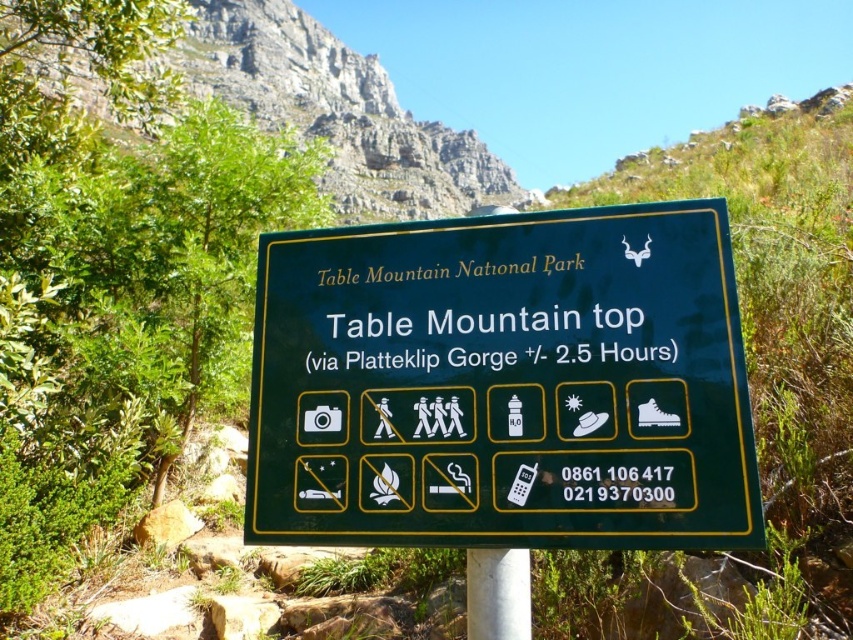
Question: From the image, what is the correct spatial relationship of green matte sign at center in relation to white smooth pole at center?

Choices:
 (A) right
 (B) left

Answer: (B)

Question: Does green matte sign at center lie in front of white smooth pole at center?

Choices:
 (A) no
 (B) yes

Answer: (B)

Question: Can you confirm if green matte sign at center is bigger than white smooth pole at center?

Choices:
 (A) yes
 (B) no

Answer: (A)

Question: Among these points, which one is farthest from the camera?

Choices:
 (A) (450, 520)
 (B) (494, 572)

Answer: (B)